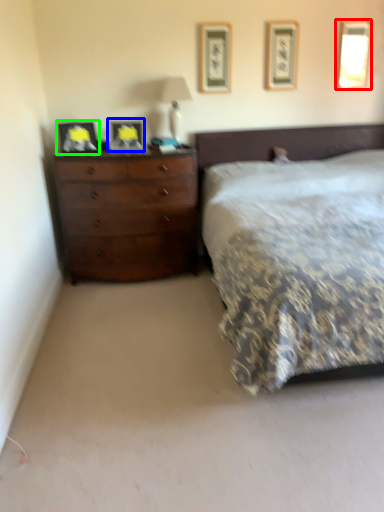
Question: Estimate the real-world distances between objects in this image. Which object is closer to picture frame (highlighted by a red box), picture frame (highlighted by a blue box) or picture frame (highlighted by a green box)?

Choices:
 (A) picture frame
 (B) picture frame

Answer: (A)